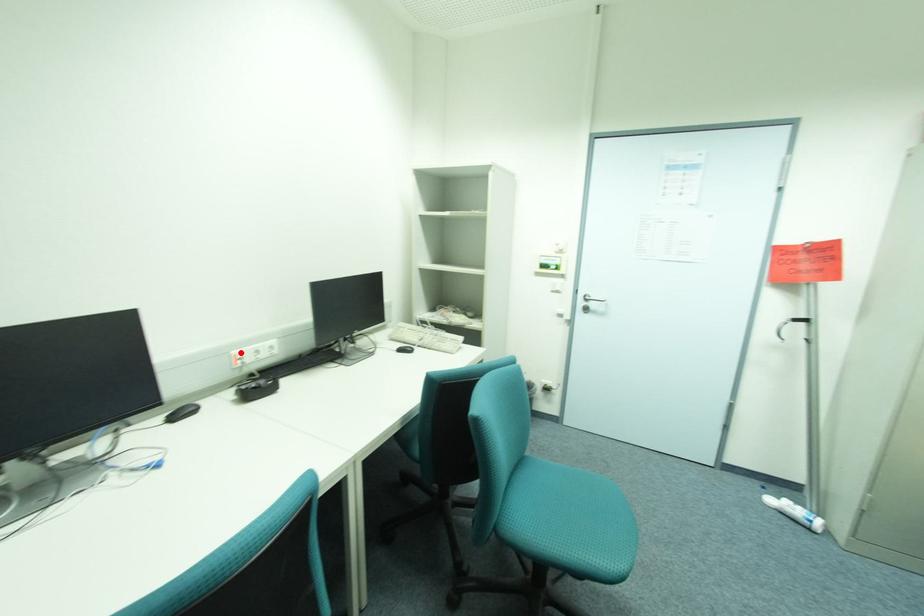
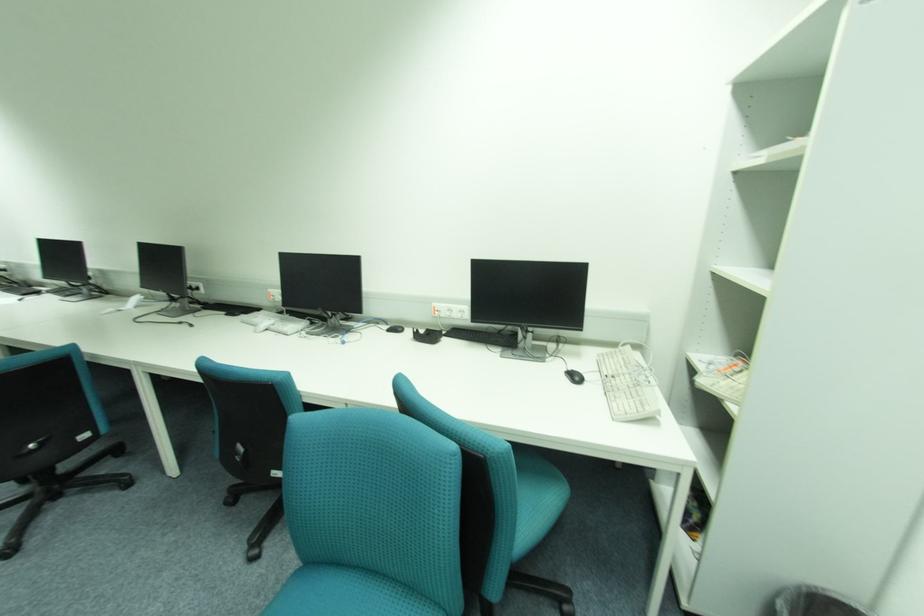
Find the pixel in the second image that matches the highlighted location in the first image.

(441, 305)